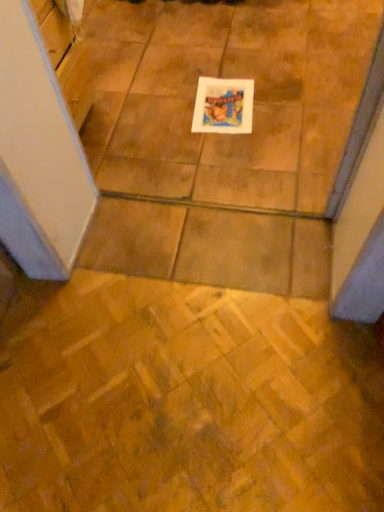
Locate an element on the screen. This screenshot has height=512, width=384. vacant space behind white paper at center is located at coordinates (220, 68).